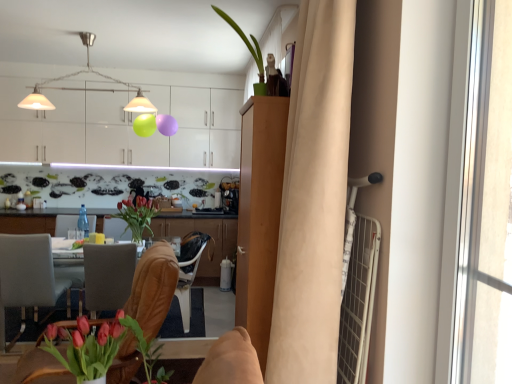
Question: Would you say matte glass vase at center, which is counted as the 1th floral arrangement, starting from the top, is to the left or to the right of light brown wood cabinet at center, acting as the 1th cabinetry starting from the front, in the picture?

Choices:
 (A) left
 (B) right

Answer: (A)

Question: From a real-world perspective, relative to light brown wood cabinet at center, acting as the 1th cabinetry starting from the front, is matte glass vase at center, the 2th floral arrangement when ordered from bottom to top, vertically above or below?

Choices:
 (A) above
 (B) below

Answer: (B)

Question: Considering the real-world distances, which object is farthest from the beige fabric curtain at right?

Choices:
 (A) green matte plant at upper center
 (B) matte glass vase at center, the 2th floral arrangement when ordered from bottom to top
 (C) matte gray chair at lower left, arranged as the 1th chair when viewed from the back
 (D) green matte plant at lower center
 (E) white glossy cabinets at upper center, arranged as the first cabinetry when viewed from the back

Answer: (E)

Question: Which of these objects is positioned closest to the matte gray chair at lower left, arranged as the 1th chair when viewed from the back?

Choices:
 (A) matte pink tulips in vase at lower left, positioned as the 2th floral arrangement in left-to-right order
 (B) leather at center, which is the first chair from front to back
 (C) beige fabric curtain at right
 (D) matte white coffee cup at center
 (E) matte glass vase at center, acting as the 2th floral arrangement starting from the front

Answer: (D)